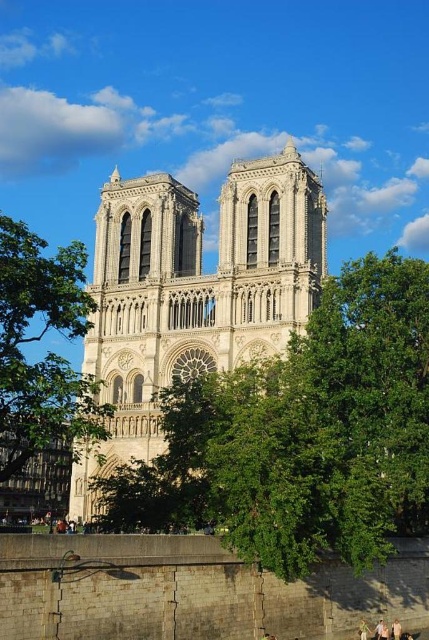
Question: Which object is positioned closest to the green leafy tree at left?

Choices:
 (A) light brown wooden person at center
 (B) white stone tower at center
 (C) light brown wooden chair at lower center
 (D) light brown hair at lower center

Answer: (B)

Question: Does white stone tower at center have a larger size compared to light brown hair at lower center?

Choices:
 (A) yes
 (B) no

Answer: (A)

Question: Is light brown wooden person at center to the right of light brown hair at lower center from the viewer's perspective?

Choices:
 (A) no
 (B) yes

Answer: (B)

Question: Which object is farther from the camera taking this photo?

Choices:
 (A) light brown wooden chair at lower center
 (B) light brown hair at lower center
 (C) green leafy tree at left

Answer: (B)

Question: Which is nearer to the white stone tower at center?

Choices:
 (A) light brown wooden chair at lower center
 (B) light brown hair at lower center
 (C) light brown wooden person at center

Answer: (A)

Question: Does white stone tower at center appear on the left side of green leafy tree at left?

Choices:
 (A) yes
 (B) no

Answer: (B)